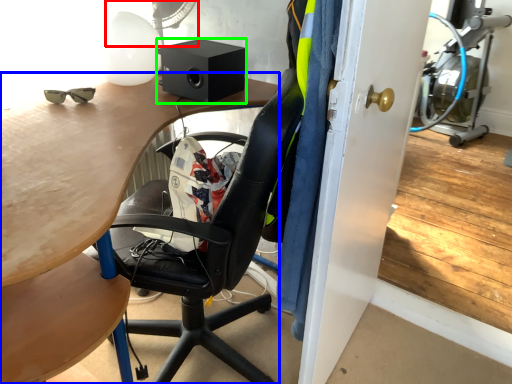
Question: Considering the real-world distances, which object is farthest from mechanical fan (highlighted by a red box)? desk (highlighted by a blue box) or loudspeaker (highlighted by a green box)?

Choices:
 (A) desk
 (B) loudspeaker

Answer: (A)